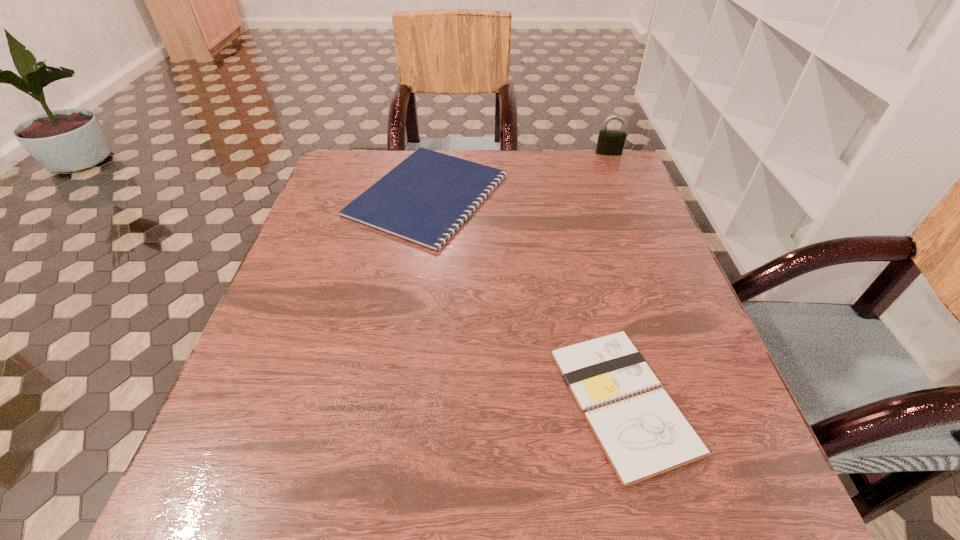
At what (x,y) coordinates should I click in order to perform the action: click on vacant space at the right edge of the desktop. Please return your answer as a coordinate pair (x, y). This screenshot has width=960, height=540. Looking at the image, I should click on (614, 263).

Identify the location of vacant space at the near left corner. (193, 490).

Where is `blank space at the far right corner of the desktop`? blank space at the far right corner of the desktop is located at coordinates (575, 169).

Find the location of a particular element. This screenshot has height=540, width=960. free spot between the tallest object and the left notepad is located at coordinates (x=518, y=174).

The image size is (960, 540). What are the coordinates of `free space between the nearer notepad and the farther notepad` in the screenshot? It's located at (525, 298).

Identify the location of empty space that is in between the right notepad and the padlock. The image size is (960, 540). (615, 277).

Where is `vacant space that's between the tallest object and the nearest object`? Image resolution: width=960 pixels, height=540 pixels. vacant space that's between the tallest object and the nearest object is located at coordinates (615, 277).

The height and width of the screenshot is (540, 960). What are the coordinates of `vacant area that lies between the nearest object and the leftmost object` in the screenshot? It's located at (525, 298).

Locate an element on the screen. The image size is (960, 540). free space between the tallest object and the left notepad is located at coordinates (518, 174).

Find the location of a particular element. This screenshot has height=540, width=960. vacant region between the left notepad and the nearer notepad is located at coordinates (525, 298).